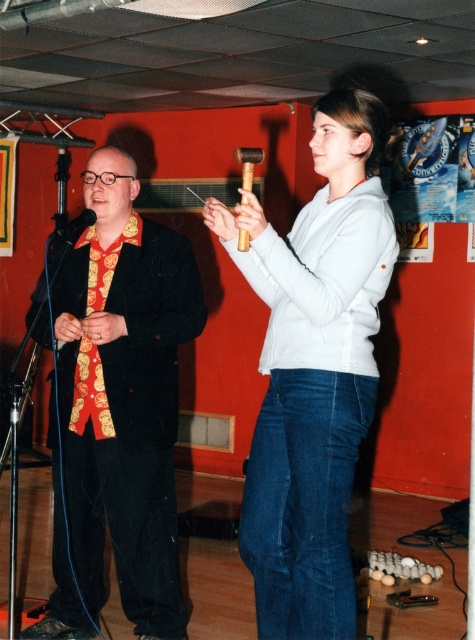
Question: Which of the following is the closest to the observer?

Choices:
 (A) wooden/matte hammer at upper center
 (B) gold printed silk tie at left
 (C) white matte sweater at center
 (D) matte black suit at left

Answer: (A)

Question: Is matte black suit at left positioned in front of gold printed silk tie at left?

Choices:
 (A) yes
 (B) no

Answer: (A)

Question: Which is nearer to the white matte sweater at center?

Choices:
 (A) black matte microphone at left
 (B) gold printed silk tie at left
 (C) wooden/matte hammer at upper center
 (D) matte black suit at left

Answer: (C)

Question: Does wooden/matte hammer at upper center have a greater width compared to black matte microphone at left?

Choices:
 (A) no
 (B) yes

Answer: (A)

Question: Is white matte sweater at center to the left of matte black suit at left from the viewer's perspective?

Choices:
 (A) no
 (B) yes

Answer: (A)

Question: Estimate the real-world distances between objects in this image. Which object is closer to the black matte microphone at left?

Choices:
 (A) white matte sweater at center
 (B) wooden/matte hammer at upper center
 (C) gold printed silk tie at left

Answer: (C)